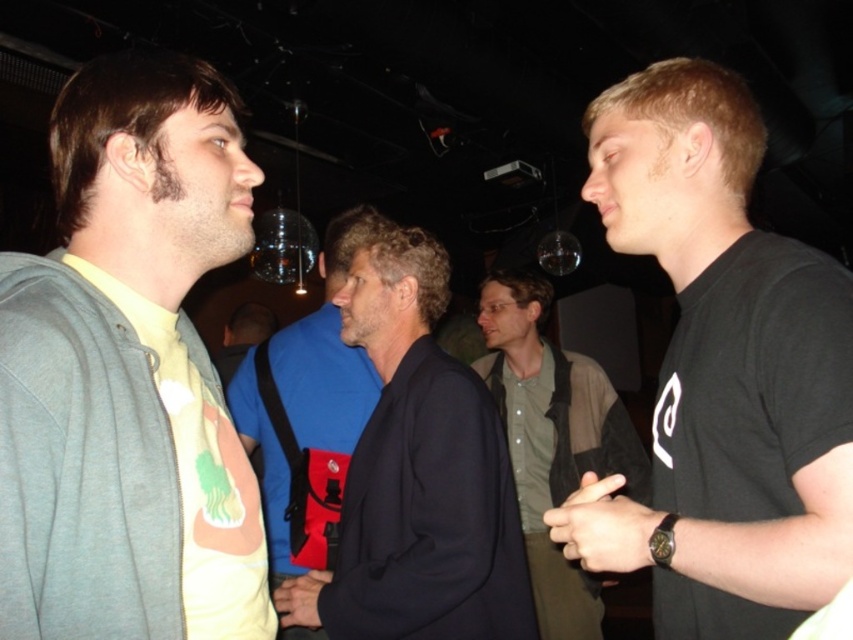
Question: Does light yellow t-shirt at left come behind black matte t-shirt at right?

Choices:
 (A) no
 (B) yes

Answer: (A)

Question: Which point appears farthest from the camera in this image?

Choices:
 (A) (808, 355)
 (B) (517, 404)
 (C) (502, 531)

Answer: (B)

Question: Which of the following is the farthest from the observer?

Choices:
 (A) black matte t-shirt at right
 (B) dark blue jacket at center

Answer: (B)

Question: Is black matte t-shirt at right to the right of green shirt at center from the viewer's perspective?

Choices:
 (A) yes
 (B) no

Answer: (B)

Question: Does dark blue jacket at center have a larger size compared to blue fabric shirt at center?

Choices:
 (A) yes
 (B) no

Answer: (B)

Question: Estimate the real-world distances between objects in this image. Which object is farther from the black matte t-shirt at right?

Choices:
 (A) blue fabric shirt at center
 (B) light yellow t-shirt at left
 (C) dark blue jacket at center
 (D) green shirt at center

Answer: (D)